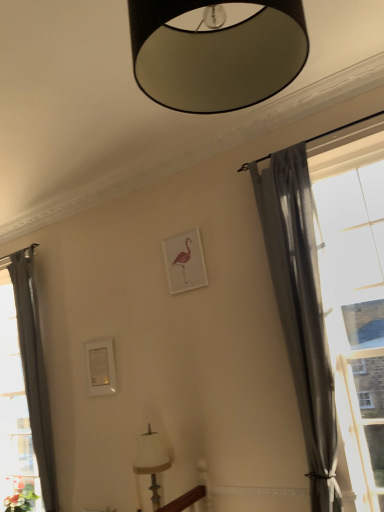
Question: Does green matte plant at lower left have a lesser width compared to white fabric lampshade at lower center, which appears as the second lamp when viewed from the top?

Choices:
 (A) yes
 (B) no

Answer: (B)

Question: Would you say green matte plant at lower left contains white fabric lampshade at lower center, which appears as the second lamp when viewed from the top?

Choices:
 (A) no
 (B) yes

Answer: (A)

Question: Is green matte plant at lower left closer to the viewer compared to white fabric lampshade at lower center, the first lamp when ordered from bottom to top?

Choices:
 (A) no
 (B) yes

Answer: (A)

Question: From a real-world perspective, is green matte plant at lower left physically below white fabric lampshade at lower center, which appears as the second lamp when viewed from the top?

Choices:
 (A) yes
 (B) no

Answer: (A)

Question: Could you tell me if green matte plant at lower left is turned towards white fabric lampshade at lower center, the first lamp when ordered from bottom to top?

Choices:
 (A) yes
 (B) no

Answer: (B)

Question: Is green matte plant at lower left wider than white fabric lampshade at lower center, the 1th lamp when ordered from back to front?

Choices:
 (A) yes
 (B) no

Answer: (A)

Question: Does white fabric lampshade at lower center, which appears as the second lamp when viewed from the top, lie behind gray sheer curtain at left, the 2th curtain in the right-to-left sequence?

Choices:
 (A) yes
 (B) no

Answer: (B)

Question: From the image's perspective, is white fabric lampshade at lower center, which is the second lamp from front to back, located above gray sheer curtain at left, which is counted as the first curtain, starting from the back?

Choices:
 (A) yes
 (B) no

Answer: (B)

Question: Is white fabric lampshade at lower center, the 1th lamp when ordered from back to front, shorter than gray sheer curtain at left, which is counted as the first curtain, starting from the back?

Choices:
 (A) yes
 (B) no

Answer: (A)

Question: Is gray sheer curtain at left, the 2th curtain in the right-to-left sequence, surrounded by white fabric lampshade at lower center, which appears as the second lamp when viewed from the top?

Choices:
 (A) yes
 (B) no

Answer: (B)

Question: Is white fabric lampshade at lower center, which is the second lamp from front to back, not within gray sheer curtain at left, which is counted as the first curtain, starting from the back?

Choices:
 (A) yes
 (B) no

Answer: (A)

Question: Can you confirm if white fabric lampshade at lower center, which appears as the second lamp when viewed from the top, is bigger than gray sheer curtain at left, the second curtain positioned from the front?

Choices:
 (A) no
 (B) yes

Answer: (A)

Question: Is white fabric lampshade at lower center, which is the second lamp from front to back, thinner than gray sheer curtain at right, marked as the 1th curtain in a front-to-back arrangement?

Choices:
 (A) no
 (B) yes

Answer: (A)